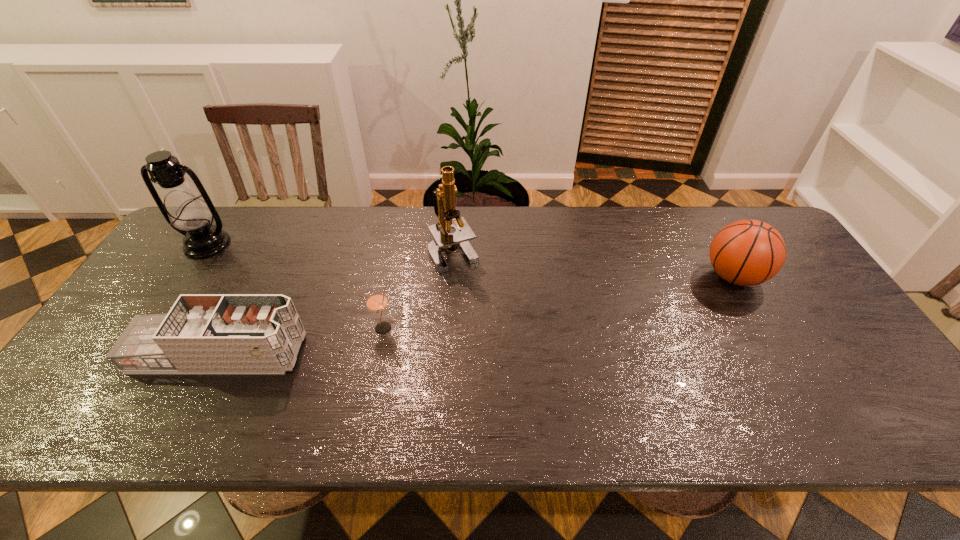
Locate an element on the screen. free space at the far right corner is located at coordinates (751, 219).

Where is `free point between the basketball and the dollhouse`? free point between the basketball and the dollhouse is located at coordinates (476, 315).

In order to click on free space between the rightmost object and the third object from right to left in this screenshot , I will do `click(559, 302)`.

In order to click on free space between the fourth object from left to right and the oil lamp in this screenshot , I will do `click(330, 248)`.

Locate an element on the screen. The width and height of the screenshot is (960, 540). free spot between the rightmost object and the dollhouse is located at coordinates (476, 315).

You are a GUI agent. You are given a task and a screenshot of the screen. Output one action in this format:
    pyautogui.click(x=<x>, y=<y>)
    Task: Click on the empty space between the rightmost object and the dollhouse
    This screenshot has height=540, width=960.
    Given the screenshot: What is the action you would take?
    pyautogui.click(x=476, y=315)

Select which object is the second closest to the rightmost object. Please provide its 2D coordinates. Your answer should be formatted as a tuple, i.e. [(x, y)], where the tuple contains the x and y coordinates of a point satisfying the conditions above.

[(376, 301)]

At what (x,y) coordinates should I click in order to perform the action: click on object that is the closest to the second object from right to left. Please return your answer as a coordinate pair (x, y). This screenshot has height=540, width=960. Looking at the image, I should click on (376, 301).

Find the location of `vacant space that satisfies the following two spatial constraints: 1. at the eyepiece of the fourth object from left to right; 2. at the entrance of the dollhouse`. vacant space that satisfies the following two spatial constraints: 1. at the eyepiece of the fourth object from left to right; 2. at the entrance of the dollhouse is located at coordinates (447, 353).

Locate an element on the screen. vacant position in the image that satisfies the following two spatial constraints: 1. on the front side of the oil lamp; 2. on the left side of the basketball is located at coordinates (185, 276).